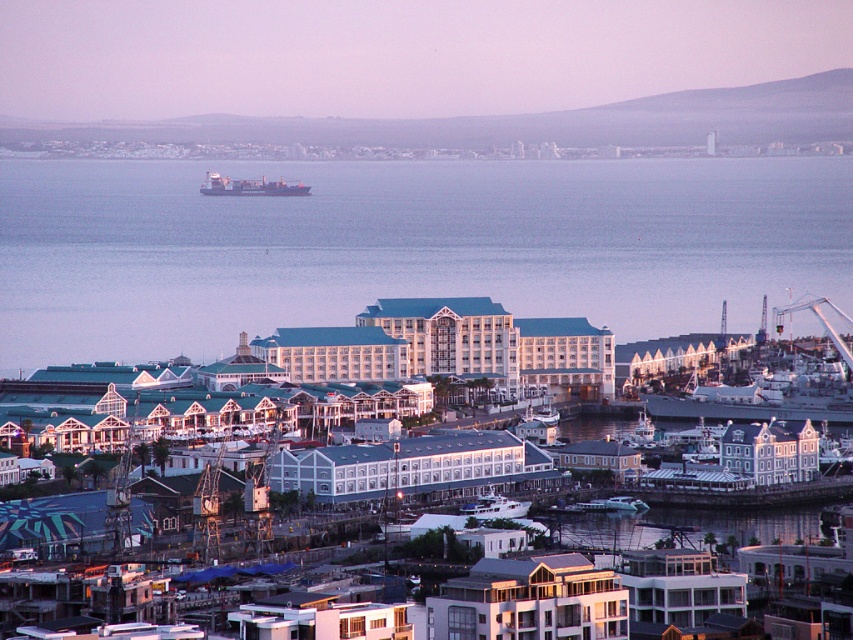
Question: Where is blue water at center located in relation to white glossy boat at center in the image?

Choices:
 (A) below
 (B) above

Answer: (B)

Question: Which of the following is the closest to the observer?

Choices:
 (A) (467, 445)
 (B) (538, 595)

Answer: (A)

Question: Is white matte building at center below white glossy boat at center?

Choices:
 (A) no
 (B) yes

Answer: (A)

Question: Among these points, which one is farthest from the camera?

Choices:
 (A) (280, 456)
 (B) (521, 560)
 (C) (631, 189)

Answer: (C)

Question: Considering the real-world distances, which object is farthest from the gray matte cargo ship at upper left?

Choices:
 (A) white matte building at center
 (B) white glossy building at center

Answer: (B)

Question: Can you confirm if blue water at center is positioned below white glossy building at center?

Choices:
 (A) yes
 (B) no

Answer: (B)